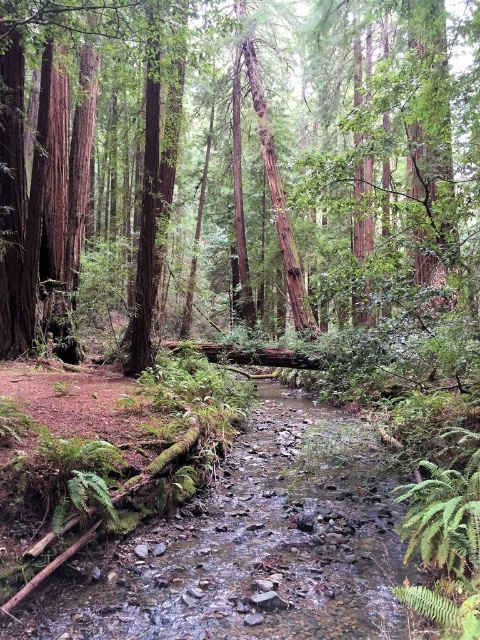
You are standing in the forest and want to take a photo of both point (302, 205) and point (165, 625). Which point should you focus on first to ensure both are in focus?

You should focus on point (302, 205) first because it is closer to the camera than point (165, 625). This way, adjusting the focus from near to far will help both points be in focus.

You are a hiker carrying a backpack and need to cross the stream. The smooth rock stream at center is slippery. Can you step on the smooth brown tree trunk at center instead?

The smooth brown tree trunk at center is larger in size than the smooth rock stream at center, so it provides a stable surface for stepping on instead of the slippery rocks.

You are standing in the forest and want to touch the smooth brown tree trunk at center. Which direction should you move from your current position at point (348, 156) to reach it?

The point (348, 156) is already indicating the smooth brown tree trunk at center, so you are already at the correct location.